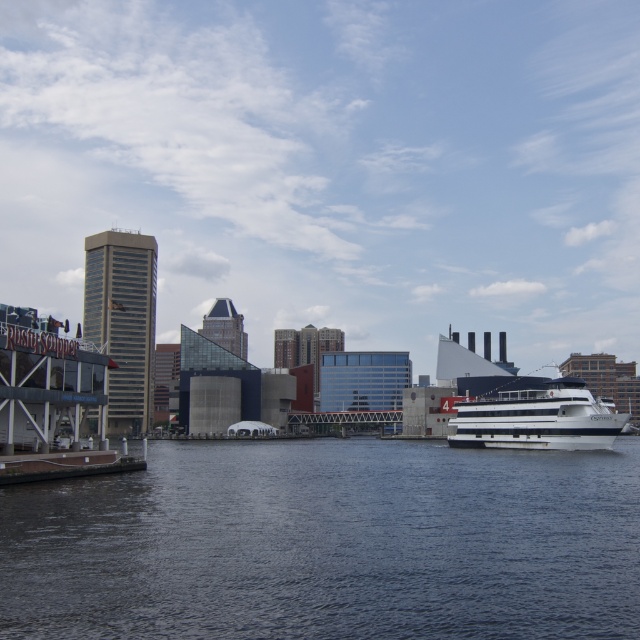
Does dark blue water at center have a lesser height compared to white glossy cruise ship at right?

Correct, dark blue water at center is not as tall as white glossy cruise ship at right.

Is point (461, 570) closer to camera compared to point (568, 408)?

Yes.

Is point (236, 531) farther from camera compared to point (532, 435)?

No.

Identify the location of dark blue water at center. The height and width of the screenshot is (640, 640). (328, 544).